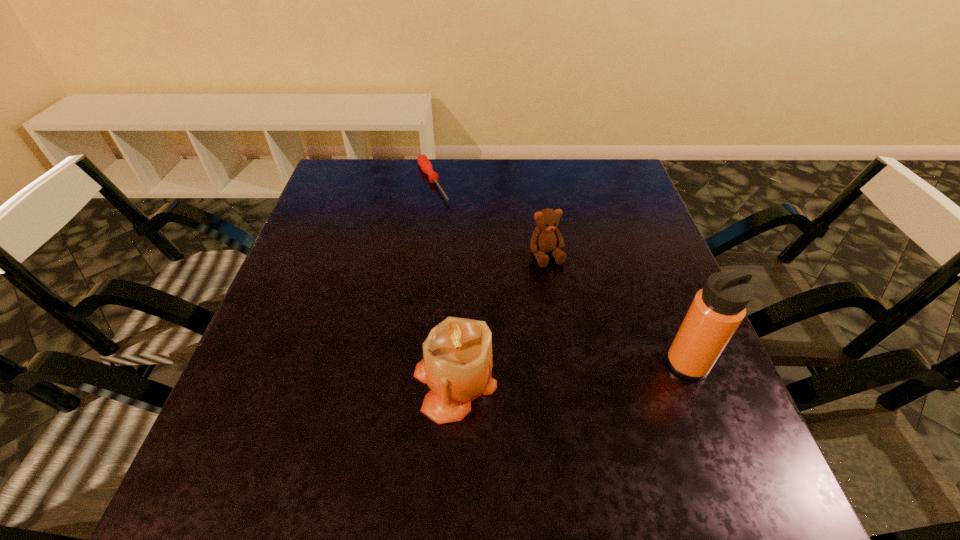
This screenshot has height=540, width=960. In order to click on free space that is in between the rightmost object and the second tallest object in this screenshot , I will do `click(571, 373)`.

Where is `free space between the farthest object and the teddy bear`? free space between the farthest object and the teddy bear is located at coordinates (490, 219).

Locate an element on the screen. free spot between the thermos bottle and the second farthest object is located at coordinates (616, 309).

Find the location of `the closest object to the rightmost object`. the closest object to the rightmost object is located at coordinates (546, 238).

I want to click on the second closest object to the shortest object, so click(457, 364).

What are the coordinates of `vacant area in the image that satisfies the following two spatial constraints: 1. on the front side of the shortest object; 2. on the right side of the tallest object` in the screenshot? It's located at (408, 364).